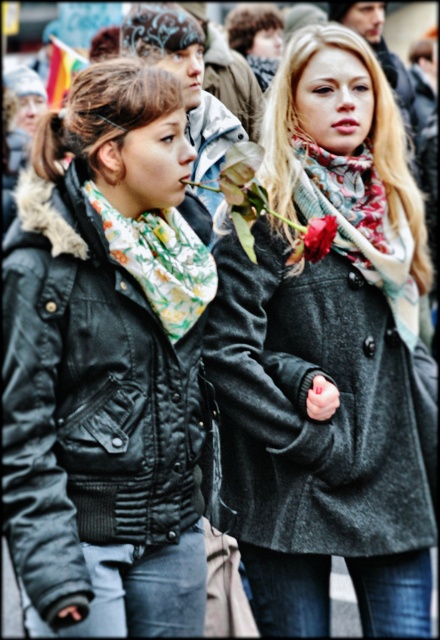
You are a photographer trying to capture a detailed shot of both the matte gray coat at center and the floral print scarf at center. Since you can only focus on one object at a time, which one should you choose to ensure the other remains somewhat in focus due to their spatial relationship?

The matte gray coat at center is closer to the viewer than the floral print scarf at center. By focusing on the matte gray coat at center, the floral print scarf at center will be slightly out of focus. Alternatively, focusing on the floral print scarf at center would leave the matte gray coat at center more in focus. However, since the question asks which to focus on to keep the other somewhat in focus, the best choice is to focus on the matte gray coat at center because it is closer, and the depth of the

You are organizing a charity event and need to display two items from the image. The display area has a width limit of 1 meter. Given that the matte gray coat at center and the floral print scarf at center must both be displayed, will their combined width exceed the limit?

The matte gray coat at center is wider than the floral print scarf at center. However, without specific measurements, it is impossible to determine if their combined width exceeds 1 meter. Additional information about each item is needed to make an accurate assessment.

You are organizing a charity event and need to display two items from the image. The matte gray coat at center and the floral print scarf at center must be placed on a mannequin. Since space is limited, which item should you place first to ensure both fit properly?

The matte gray coat at center is larger in size than the floral print scarf at center, so you should place the larger matte gray coat at center first to ensure both items fit on the mannequin.